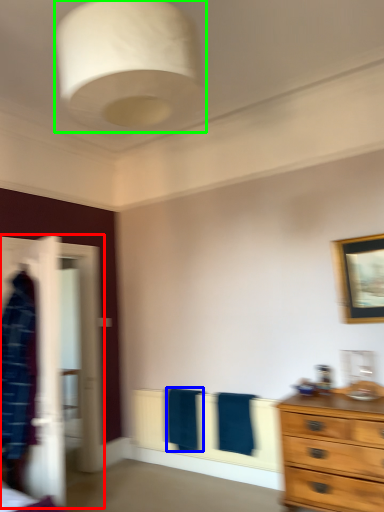
Question: Considering the real-world distances, which object is closest to closet (highlighted by a red box)? bath towel (highlighted by a blue box) or light fixture (highlighted by a green box).

Choices:
 (A) bath towel
 (B) light fixture

Answer: (A)